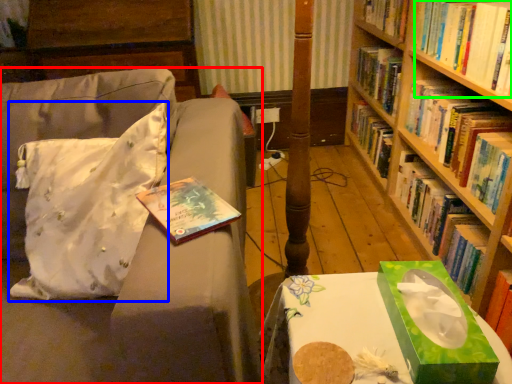
Question: Based on their relative distances, which object is farther from studio couch (highlighted by a red box)? Choose from throw pillow (highlighted by a blue box) and book (highlighted by a green box).

Choices:
 (A) throw pillow
 (B) book

Answer: (B)